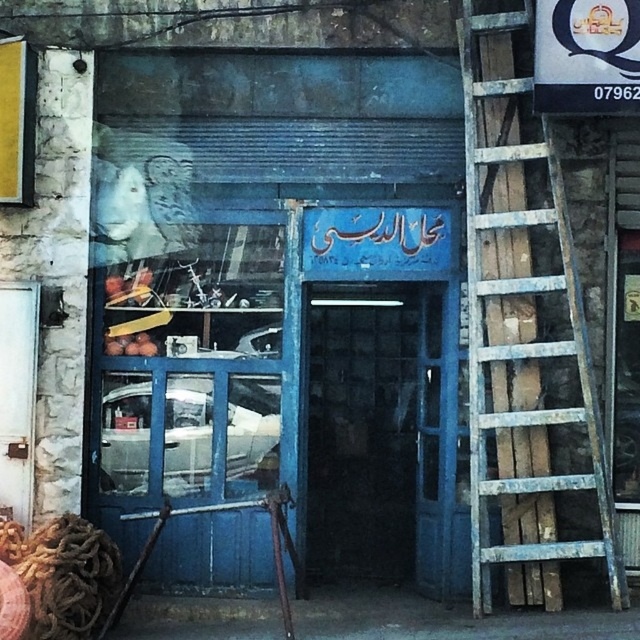
Between rusty wood ladder at right and blue glass door at center, which one is positioned higher?

Positioned higher is rusty wood ladder at right.

Does point (483, 76) come closer to viewer compared to point (433, 372)?

Yes, point (483, 76) is closer to viewer.

Is point (598, 516) positioned after point (392, 362)?

No, (598, 516) is in front of (392, 362).

In order to click on rusty wood ladder at right in this screenshot , I will do `click(518, 323)`.